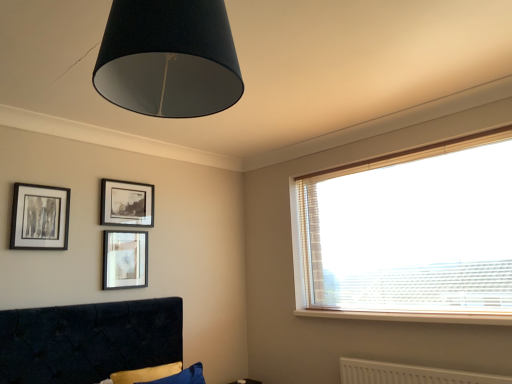
Question: Is white wood window sill at lower right to the left of white textured radiator at lower right from the viewer's perspective?

Choices:
 (A) no
 (B) yes

Answer: (B)

Question: Can you confirm if white wood window sill at lower right is smaller than white textured radiator at lower right?

Choices:
 (A) no
 (B) yes

Answer: (B)

Question: Considering the relative positions of white wood window sill at lower right and white textured radiator at lower right in the image provided, is white wood window sill at lower right behind white textured radiator at lower right?

Choices:
 (A) yes
 (B) no

Answer: (A)

Question: Is white wood window sill at lower right facing away from white textured radiator at lower right?

Choices:
 (A) no
 (B) yes

Answer: (A)

Question: From a real-world perspective, is white wood window sill at lower right over white textured radiator at lower right?

Choices:
 (A) no
 (B) yes

Answer: (B)

Question: From a real-world perspective, is white wood window sill at lower right above or below black glossy picture frame at upper center, the second picture frame viewed from the left?

Choices:
 (A) below
 (B) above

Answer: (A)

Question: Relative to black glossy picture frame at upper center, acting as the 2th picture frame starting from the right, is white wood window sill at lower right in front or behind?

Choices:
 (A) behind
 (B) front

Answer: (B)

Question: Visually, is white wood window sill at lower right positioned to the left or to the right of black glossy picture frame at upper center, acting as the 2th picture frame starting from the right?

Choices:
 (A) right
 (B) left

Answer: (A)

Question: From the image's perspective, relative to black glossy picture frame at upper center, the second picture frame viewed from the left, is white wood window sill at lower right above or below?

Choices:
 (A) above
 (B) below

Answer: (B)

Question: In terms of size, does black glossy picture frame at upper center, the second picture frame viewed from the left, appear bigger or smaller than translucent wood blinds at upper right?

Choices:
 (A) small
 (B) big

Answer: (A)

Question: From the image's perspective, relative to translucent wood blinds at upper right, is black glossy picture frame at upper center, the second picture frame viewed from the left, above or below?

Choices:
 (A) above
 (B) below

Answer: (A)

Question: Considering their positions, is black glossy picture frame at upper center, the second picture frame viewed from the left, located in front of or behind translucent wood blinds at upper right?

Choices:
 (A) behind
 (B) front

Answer: (A)

Question: Visually, is black glossy picture frame at upper center, acting as the 2th picture frame starting from the right, positioned to the left or to the right of translucent wood blinds at upper right?

Choices:
 (A) right
 (B) left

Answer: (B)

Question: Is point (111, 205) positioned closer to the camera than point (345, 360)?

Choices:
 (A) farther
 (B) closer

Answer: (A)

Question: Is black glossy picture frame at upper center, the second picture frame viewed from the left, to the left or to the right of white textured radiator at lower right in the image?

Choices:
 (A) left
 (B) right

Answer: (A)